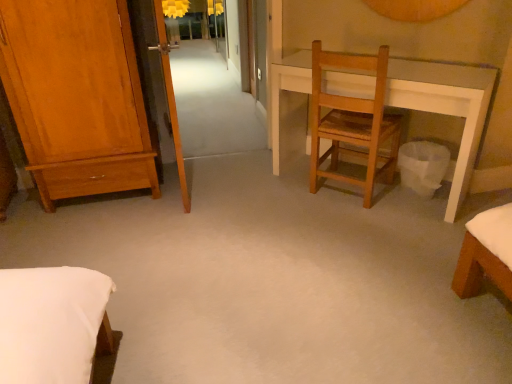
Question: Is matte yellow lampshade at upper center at the left side of wooden chair at center?

Choices:
 (A) no
 (B) yes

Answer: (B)

Question: Is matte yellow lampshade at upper center facing towards wooden chair at center?

Choices:
 (A) yes
 (B) no

Answer: (A)

Question: Considering the relative sizes of matte yellow lampshade at upper center and wooden chair at center in the image provided, is matte yellow lampshade at upper center thinner than wooden chair at center?

Choices:
 (A) yes
 (B) no

Answer: (B)

Question: From the image's perspective, is matte yellow lampshade at upper center under wooden chair at center?

Choices:
 (A) yes
 (B) no

Answer: (B)

Question: From a real-world perspective, is matte yellow lampshade at upper center physically below wooden chair at center?

Choices:
 (A) yes
 (B) no

Answer: (A)

Question: Is shiny brown wardrobe at left inside the boundaries of white paper trash can at lower right, or outside?

Choices:
 (A) outside
 (B) inside

Answer: (A)

Question: From the image's perspective, is shiny brown wardrobe at left above or below white paper trash can at lower right?

Choices:
 (A) above
 (B) below

Answer: (A)

Question: Considering the positions of shiny brown wardrobe at left and white paper trash can at lower right in the image, is shiny brown wardrobe at left bigger or smaller than white paper trash can at lower right?

Choices:
 (A) big
 (B) small

Answer: (A)

Question: In the image, is shiny brown wardrobe at left positioned in front of or behind white paper trash can at lower right?

Choices:
 (A) behind
 (B) front

Answer: (B)

Question: In terms of width, does shiny brown wardrobe at left look wider or thinner when compared to wooden chair at center?

Choices:
 (A) thin
 (B) wide

Answer: (B)

Question: Does point (36, 158) appear closer or farther from the camera than point (333, 96)?

Choices:
 (A) farther
 (B) closer

Answer: (A)

Question: Looking at the image, does shiny brown wardrobe at left seem bigger or smaller compared to wooden chair at center?

Choices:
 (A) small
 (B) big

Answer: (B)

Question: Is shiny brown wardrobe at left taller or shorter than wooden chair at center?

Choices:
 (A) tall
 (B) short

Answer: (A)

Question: Based on their positions, is wooden chair at center located to the left or right of transparent glass screen door at upper left?

Choices:
 (A) right
 (B) left

Answer: (A)

Question: Is point coord(373,64) closer or farther from the camera than point coord(158,66)?

Choices:
 (A) farther
 (B) closer

Answer: (B)